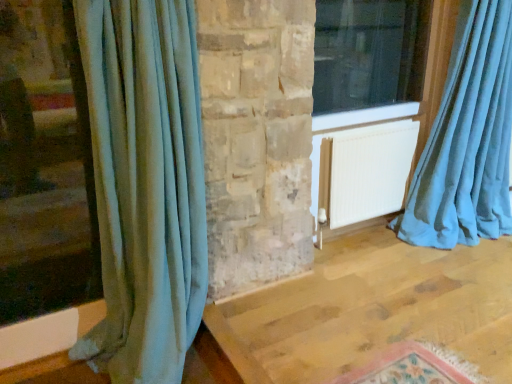
Find the location of `free space in front of teal velvet curtain at right, the first curtain when ordered from right to left`. free space in front of teal velvet curtain at right, the first curtain when ordered from right to left is located at coordinates (465, 276).